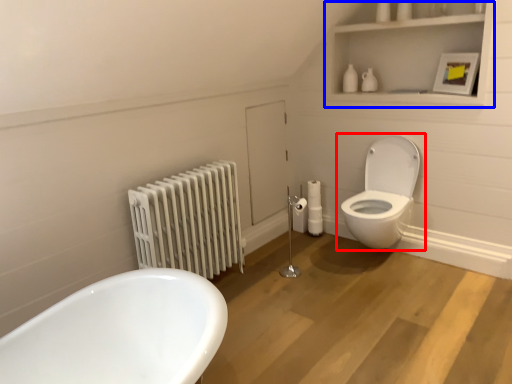
Question: Which object is closer to the camera taking this photo, toilet (highlighted by a red box) or medicine cabinet (highlighted by a blue box)?

Choices:
 (A) toilet
 (B) medicine cabinet

Answer: (B)